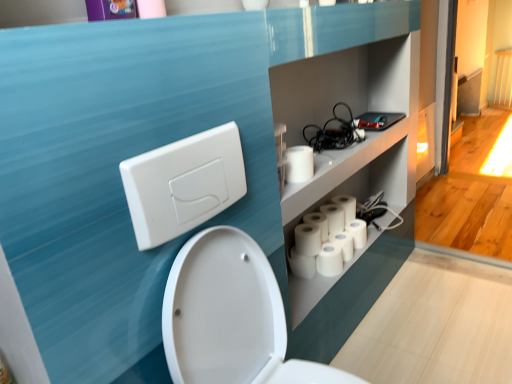
I want to click on free space underneath black rubber cables at upper right (from a real-world perspective), so click(334, 147).